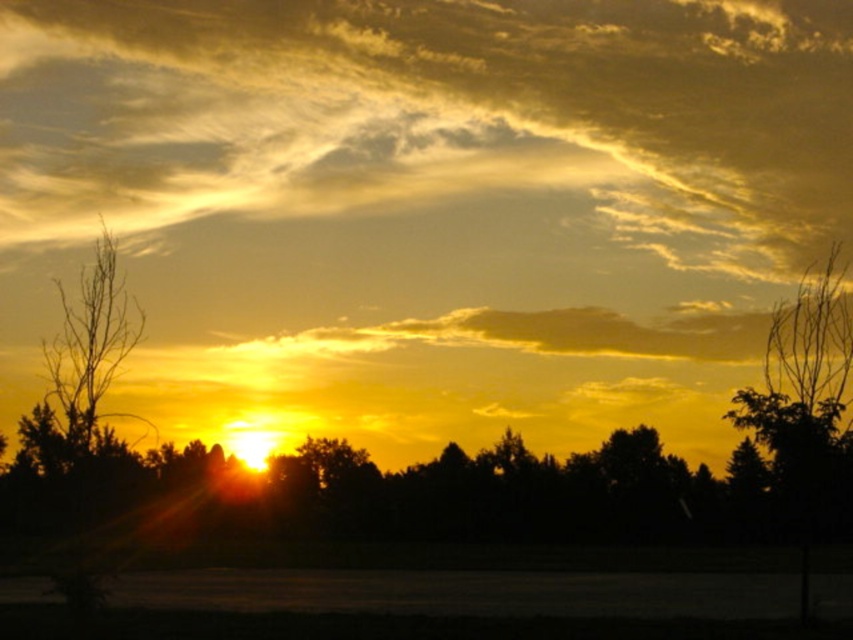
Question: Does golden/yellow cloud at upper center have a greater width compared to bare branches at left?

Choices:
 (A) no
 (B) yes

Answer: (B)

Question: Observing the image, what is the correct spatial positioning of golden/yellow cloud at upper center in reference to bare branches at left?

Choices:
 (A) above
 (B) below

Answer: (A)

Question: Which point is closer to the camera taking this photo?

Choices:
 (A) (94, 400)
 (B) (256, 285)

Answer: (A)

Question: Is golden/yellow cloud at upper center to the left of bare branches at left from the viewer's perspective?

Choices:
 (A) no
 (B) yes

Answer: (A)